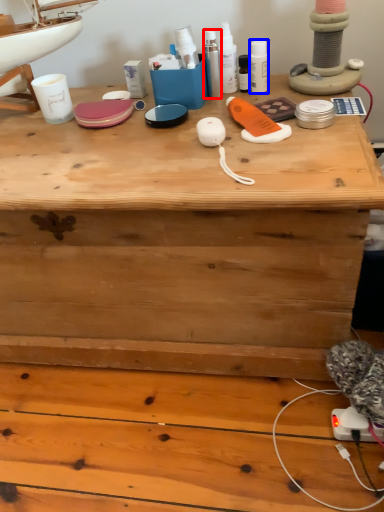
Question: Which object appears farthest to the camera in this image, toiletry (highlighted by a red box) or toiletry (highlighted by a blue box)?

Choices:
 (A) toiletry
 (B) toiletry

Answer: (B)